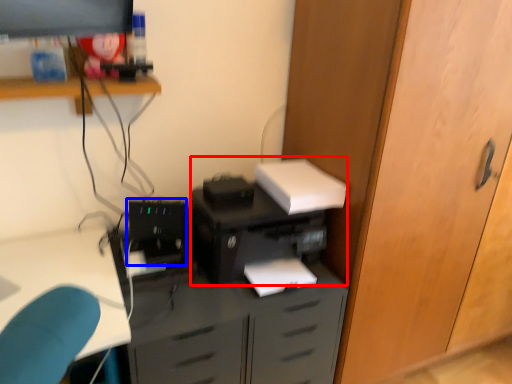
Question: Which point is closer to the camera, printer (highlighted by a red box) or computer tower (highlighted by a blue box)?

Choices:
 (A) printer
 (B) computer tower

Answer: (A)